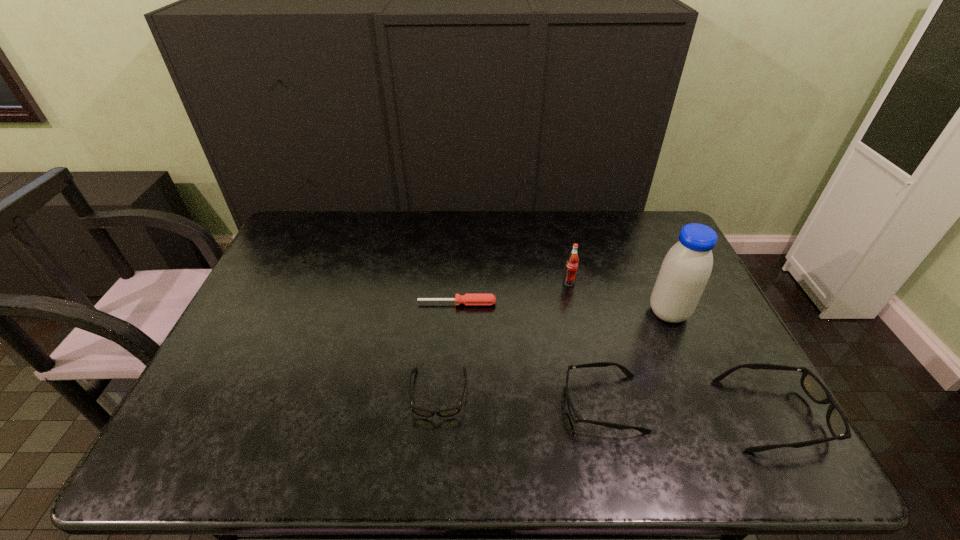
The image size is (960, 540). I want to click on vacant region between the second spectacles from left to right and the farthest object, so click(x=586, y=343).

The height and width of the screenshot is (540, 960). In order to click on vacant area that lies between the farthest object and the leftmost spectacles in this screenshot , I will do `click(504, 338)`.

The image size is (960, 540). Find the location of `blank region between the shortest object and the fifth shortest object`. blank region between the shortest object and the fifth shortest object is located at coordinates (513, 293).

I want to click on empty space between the fifth tallest object and the second spectacles from right to left, so click(520, 399).

Locate an element on the screen. This screenshot has width=960, height=540. the fifth closest object to the second shortest object is located at coordinates [838, 426].

I want to click on object that is the fifth closest to the second spectacles from right to left, so click(572, 262).

This screenshot has width=960, height=540. In order to click on the second closest spectacles relative to the soya milk in this screenshot , I will do `click(573, 414)`.

Identify which spectacles is the third closest to the screwdriver. Please provide its 2D coordinates. Your answer should be formatted as a tuple, i.e. [(x, y)], where the tuple contains the x and y coordinates of a point satisfying the conditions above.

[(838, 426)]

Identify the location of free space that satisfies the following two spatial constraints: 1. on the label of the fifth shortest object; 2. on the right side of the soya milk. (576, 313).